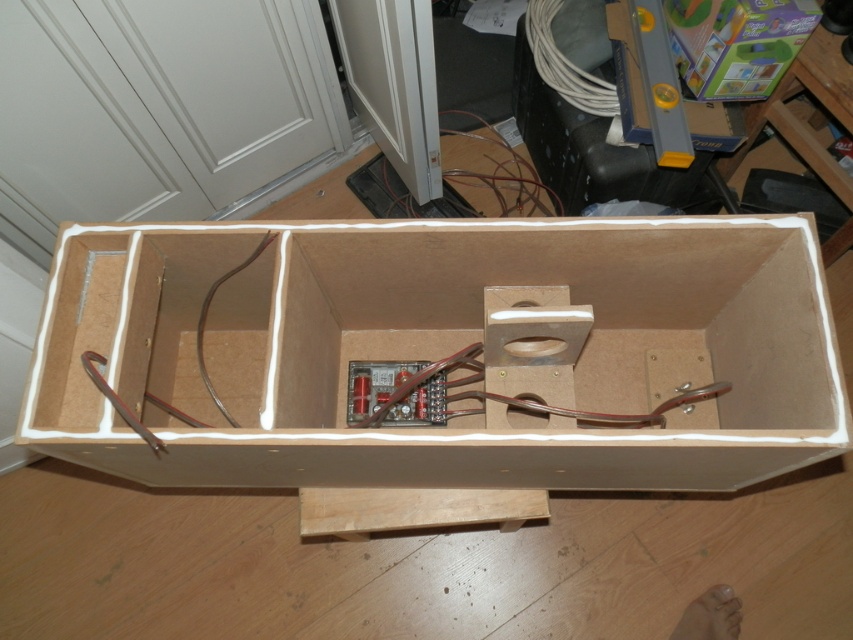
Question: Based on their relative distances, which object is nearer to the white cable at upper right?

Choices:
 (A) brown cardboard box at center
 (B) green cardboard box at upper right

Answer: (B)

Question: Among these objects, which one is farthest from the camera?

Choices:
 (A) brown cardboard box at center
 (B) green cardboard box at upper right
 (C) white cable at upper right

Answer: (C)

Question: Among these points, which one is farthest from the camera?

Choices:
 (A) click(x=573, y=84)
 (B) click(x=155, y=458)

Answer: (A)

Question: Can you confirm if brown cardboard box at center is thinner than green cardboard box at upper right?

Choices:
 (A) no
 (B) yes

Answer: (A)

Question: Is brown cardboard box at center below green cardboard box at upper right?

Choices:
 (A) no
 (B) yes

Answer: (B)

Question: Does green cardboard box at upper right have a lesser width compared to white cable at upper right?

Choices:
 (A) yes
 (B) no

Answer: (B)